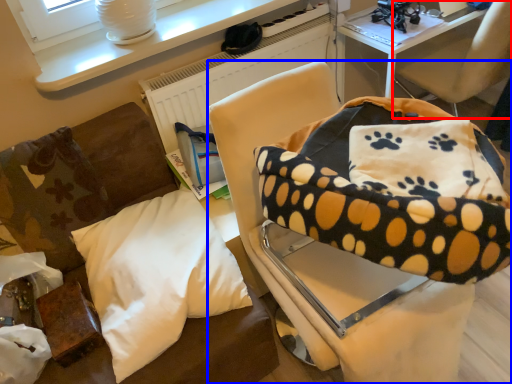
Question: Among these objects, which one is nearest to the camera, chair (highlighted by a red box) or chair (highlighted by a blue box)?

Choices:
 (A) chair
 (B) chair

Answer: (B)